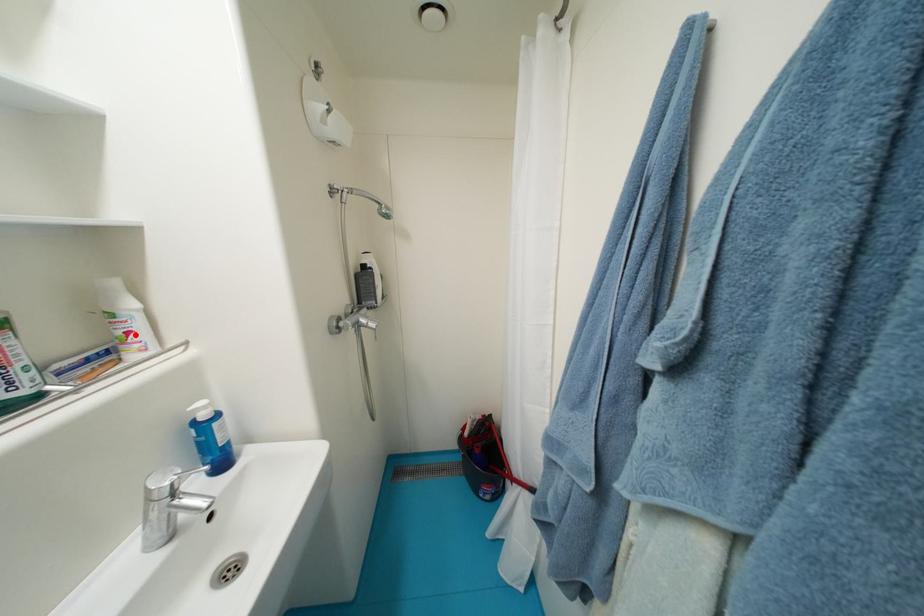
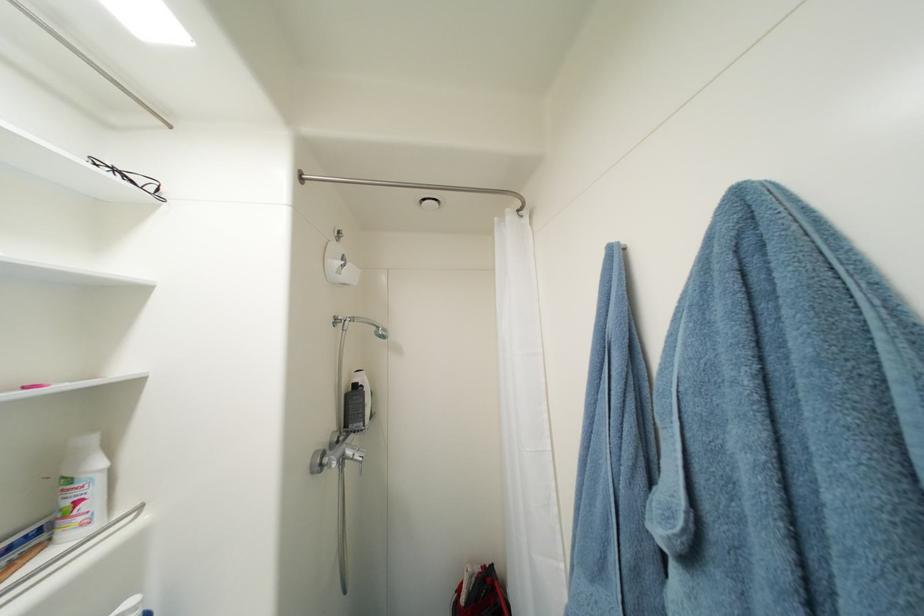
Find the pixel in the second image that matches the highlighted location in the first image.

(84, 504)